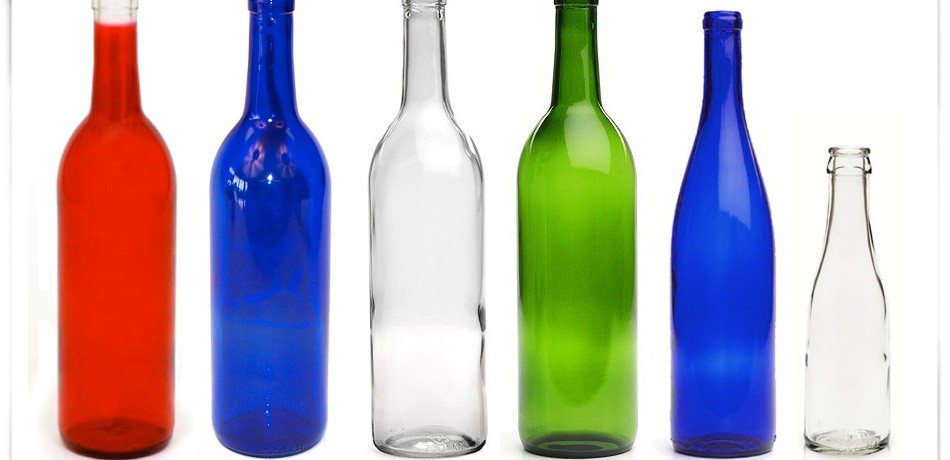
Find the location of a particular element. The image size is (950, 460). glass bottle bases is located at coordinates (149, 449), (261, 454), (437, 454), (571, 456), (733, 454), (834, 451).